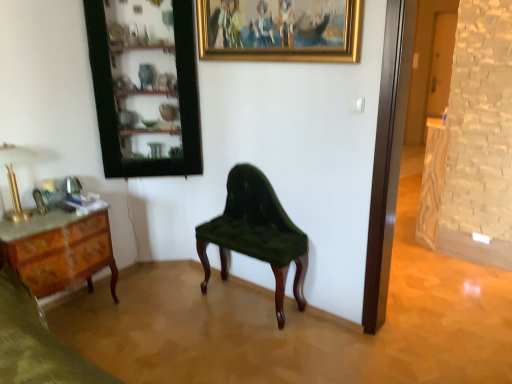
Question: Is the position of velvet green chair at center more distant than that of wooden cabinet at upper left?

Choices:
 (A) no
 (B) yes

Answer: (A)

Question: Is velvet green chair at center taller than wooden cabinet at upper left?

Choices:
 (A) yes
 (B) no

Answer: (B)

Question: Is velvet green chair at center to the left of wooden cabinet at upper left from the viewer's perspective?

Choices:
 (A) yes
 (B) no

Answer: (B)

Question: Is velvet green chair at center far away from wooden cabinet at upper left?

Choices:
 (A) no
 (B) yes

Answer: (A)

Question: Is velvet green chair at center at the right side of wooden cabinet at upper left?

Choices:
 (A) yes
 (B) no

Answer: (A)

Question: From the image's perspective, is wooden cabinet at upper left positioned above or below marble top wood desk at left?

Choices:
 (A) above
 (B) below

Answer: (A)

Question: Is wooden cabinet at upper left to the left or to the right of marble top wood desk at left in the image?

Choices:
 (A) left
 (B) right

Answer: (B)

Question: Is wooden cabinet at upper left wider or thinner than marble top wood desk at left?

Choices:
 (A) wide
 (B) thin

Answer: (B)

Question: Does point (125, 74) appear closer or farther from the camera than point (50, 284)?

Choices:
 (A) farther
 (B) closer

Answer: (A)

Question: Relative to gold polished metal lamp at left, is velvet green chair at center in front or behind?

Choices:
 (A) front
 (B) behind

Answer: (B)

Question: Choose the correct answer: Is velvet green chair at center inside gold polished metal lamp at left or outside it?

Choices:
 (A) outside
 (B) inside

Answer: (A)

Question: Would you say velvet green chair at center is to the left or to the right of gold polished metal lamp at left in the picture?

Choices:
 (A) right
 (B) left

Answer: (A)

Question: Does point (266, 188) appear closer or farther from the camera than point (5, 148)?

Choices:
 (A) farther
 (B) closer

Answer: (A)

Question: Is gold polished metal lamp at left in front of or behind gold/golden frame at upper center in the image?

Choices:
 (A) behind
 (B) front

Answer: (A)

Question: Considering the positions of point (4, 215) and point (239, 19), is point (4, 215) closer or farther from the camera than point (239, 19)?

Choices:
 (A) farther
 (B) closer

Answer: (B)